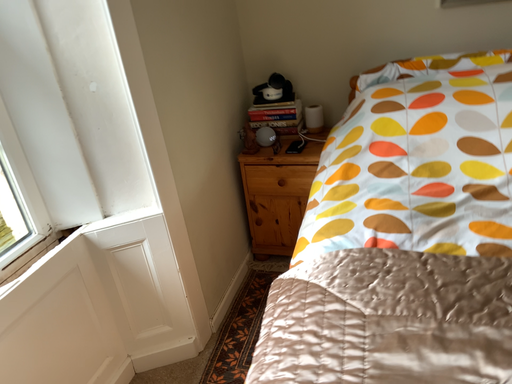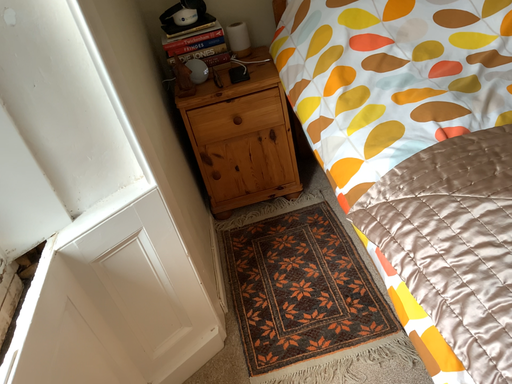
Question: Which way did the camera rotate in the video?

Choices:
 (A) rotated right
 (B) rotated left

Answer: (A)